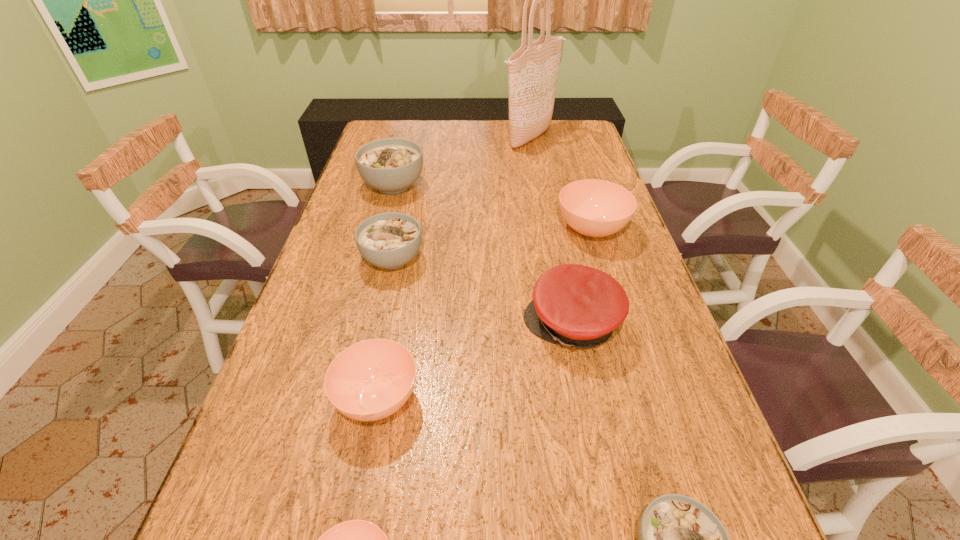
The height and width of the screenshot is (540, 960). I want to click on shopping bag situated at the right edge, so click(533, 69).

This screenshot has height=540, width=960. In order to click on soup bowl positioned at the right edge in this screenshot , I will do `click(596, 208)`.

Find the location of a particular element. cap at the right edge is located at coordinates (577, 306).

At what (x,y) coordinates should I click in order to perform the action: click on object present at the far right corner. Please return your answer as a coordinate pair (x, y). The width and height of the screenshot is (960, 540). Looking at the image, I should click on (533, 69).

Find the location of a particular element. Image resolution: width=960 pixels, height=540 pixels. blank space at the far edge of the desktop is located at coordinates (463, 139).

Identify the location of vacant space at the left edge of the desktop. This screenshot has height=540, width=960. (271, 420).

In the image, there is a desktop. In order to click on vacant space at the right edge in this screenshot , I will do `click(655, 402)`.

Find the location of a particular element. free area in between the shopping bag and the second farthest peach soup bowl is located at coordinates (454, 268).

Where is `free space between the sixth farthest object and the rightmost peach soup bowl`? free space between the sixth farthest object and the rightmost peach soup bowl is located at coordinates (485, 314).

Find the location of `unoccupied area between the second smallest white soup bowl and the fifth farthest object`. unoccupied area between the second smallest white soup bowl and the fifth farthest object is located at coordinates (483, 292).